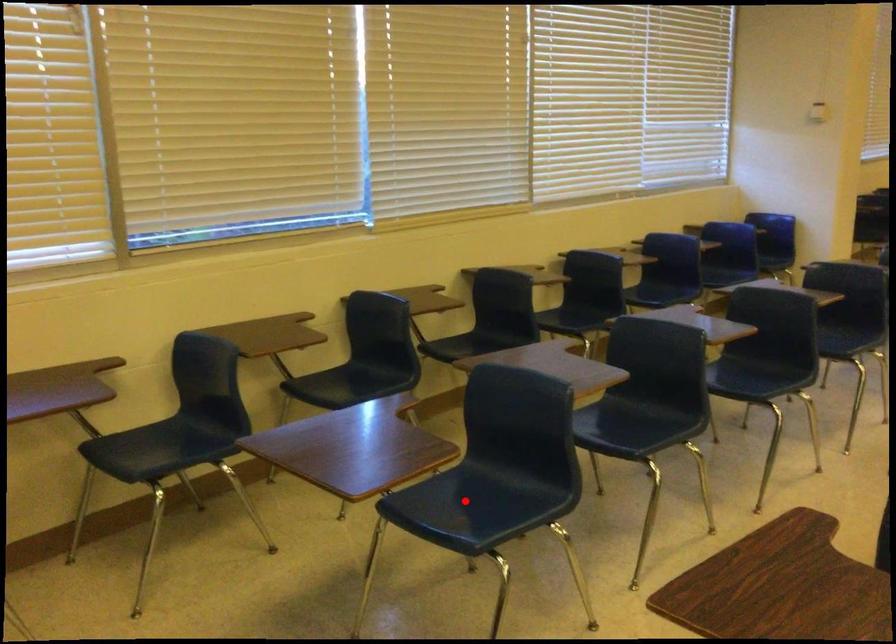
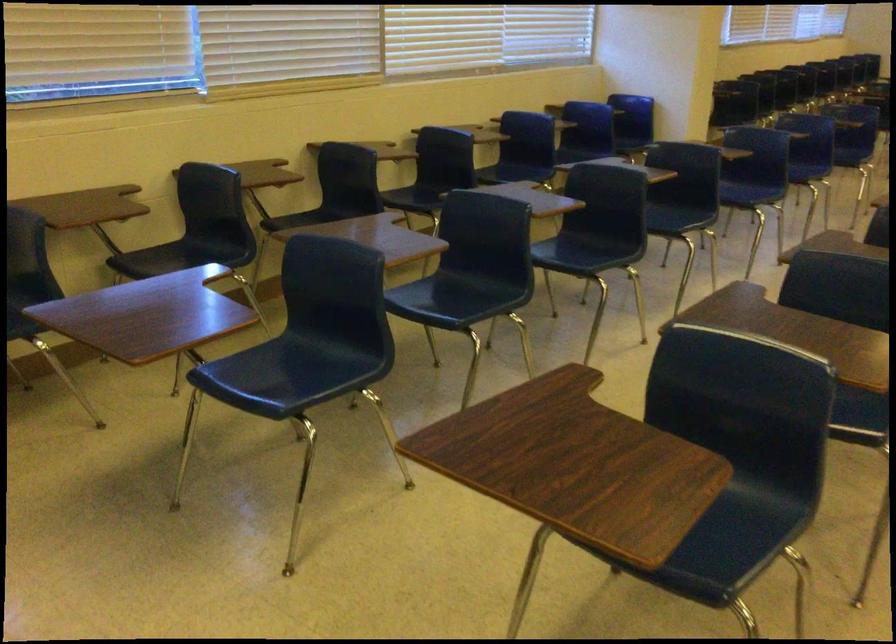
The point at the highlighted location is marked in the first image. Where is the corresponding point in the second image?

(283, 375)